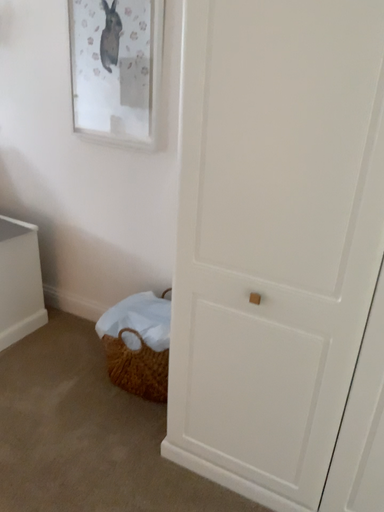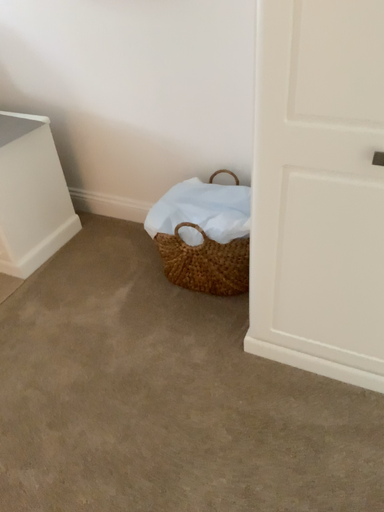
Question: Which way did the camera rotate in the video?

Choices:
 (A) rotated upward
 (B) rotated downward

Answer: (B)